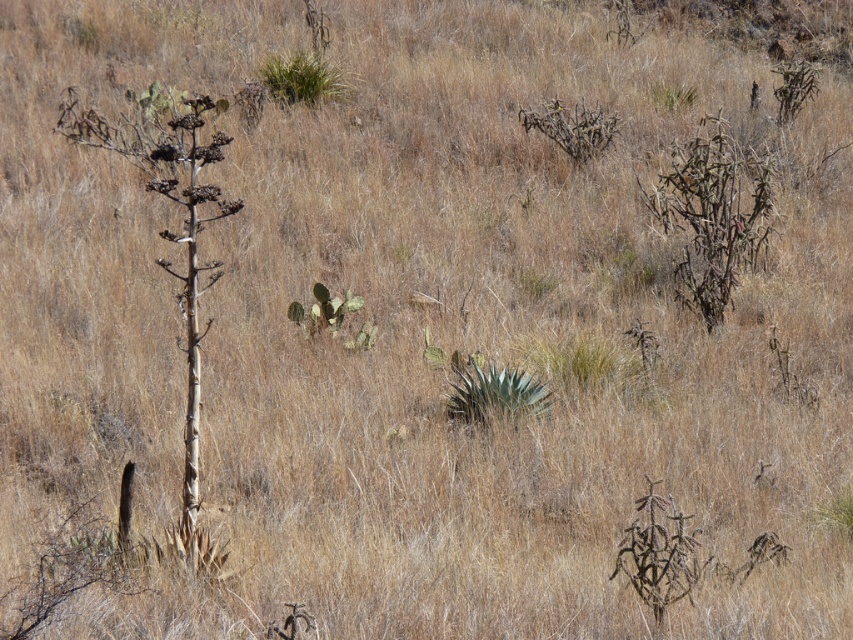
Which is above, green leafy plant at center or green leafy plant at upper center?

Positioned higher is green leafy plant at upper center.

I want to click on green leafy plant at center, so click(x=495, y=392).

Does point (543, 406) come in front of point (323, 88)?

Yes, it is in front of point (323, 88).

The image size is (853, 640). In order to click on green leafy plant at center in this screenshot , I will do tap(495, 392).